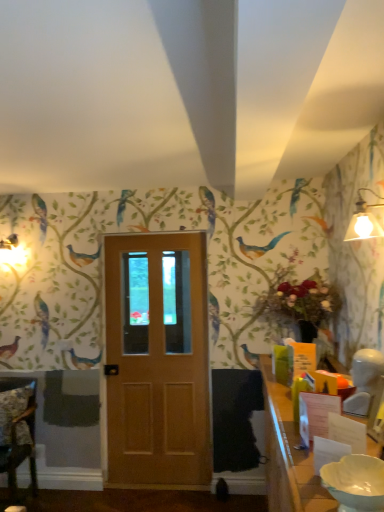
Describe the element at coordinates (355, 483) in the screenshot. The height and width of the screenshot is (512, 384). I see `white glossy bowl at lower right` at that location.

The image size is (384, 512). What do you see at coordinates (16, 437) in the screenshot?
I see `wooden chair at lower left` at bounding box center [16, 437].

Find the location of a particular element. matte wood door at center is located at coordinates (157, 360).

Looking at this image, could you tell me if wooden chair at lower left is turned towards matte white lampshade at upper right?

No, wooden chair at lower left does not turn towards matte white lampshade at upper right.

What's the angular difference between wooden chair at lower left and matte white lampshade at upper right's facing directions?

There is a 89.4-degree angle between the facing directions of wooden chair at lower left and matte white lampshade at upper right.

Is wooden chair at lower left far from matte white lampshade at upper right?

wooden chair at lower left is positioned a significant distance from matte white lampshade at upper right.

Is white glossy bowl at lower right inside or outside of matte white lampshade at upper right?

white glossy bowl at lower right exists outside the volume of matte white lampshade at upper right.

Is white glossy bowl at lower right facing towards matte white lampshade at upper right?

No, white glossy bowl at lower right is not aimed at matte white lampshade at upper right.

Is white glossy bowl at lower right behind matte white lampshade at upper right?

No, it is not.

Is white glossy bowl at lower right wider or thinner than matte white lampshade at upper right?

white glossy bowl at lower right is wider than matte white lampshade at upper right.

Is wooden chair at lower left positioned far away from white glossy bowl at lower right?

wooden chair at lower left is far away from white glossy bowl at lower right.

Considering the points (29, 381) and (349, 476), which point is in front, point (29, 381) or point (349, 476)?

Point (349, 476)

Image resolution: width=384 pixels, height=512 pixels. I want to click on bowl lying in front of the wooden chair at lower left, so click(355, 483).

Considering the relative positions of wooden chair at lower left and white glossy bowl at lower right in the image provided, is wooden chair at lower left to the left of white glossy bowl at lower right from the viewer's perspective?

Yes, wooden chair at lower left is to the left of white glossy bowl at lower right.

Based on the photo, is matte white lampshade at upper right far from white glossy table at lower right?

Yes, matte white lampshade at upper right and white glossy table at lower right are located far from each other.

From a real-world perspective, is matte white lampshade at upper right positioned under white glossy table at lower right based on gravity?

No, from a real-world perspective, matte white lampshade at upper right is not below white glossy table at lower right.

Is matte white lampshade at upper right behind white glossy table at lower right?

Yes.

From the picture: Is white glossy table at lower right bigger or smaller than matte white lampshade at upper right?

white glossy table at lower right is bigger than matte white lampshade at upper right.

Between white glossy table at lower right and matte white lampshade at upper right, which one has larger width?

Wider between the two is white glossy table at lower right.

Which is correct: white glossy table at lower right is inside matte white lampshade at upper right, or outside of it?

white glossy table at lower right is outside matte white lampshade at upper right.

Could you tell me if matte wood door at center is turned towards matte white lampshade at upper right?

No, matte wood door at center is not turned towards matte white lampshade at upper right.

Considering the positions of objects matte wood door at center and matte white lampshade at upper right in the image provided, who is more to the left, matte wood door at center or matte white lampshade at upper right?

matte wood door at center.

The image size is (384, 512). I want to click on light fixture on the right of matte wood door at center, so click(364, 220).

How far apart are matte white lampshade at upper right and wooden chair at lower left?

They are 8.81 feet apart.

In the scene shown: How many degrees apart are the facing directions of matte white lampshade at upper right and wooden chair at lower left?

89.4 degrees.

Is matte white lampshade at upper right oriented away from wooden chair at lower left?

No, matte white lampshade at upper right is not facing the opposite direction of wooden chair at lower left.

Is point (357, 234) behind point (2, 452)?

No, (357, 234) is closer to viewer.

Identify the location of chair on the left of matte white lampshade at upper right. [16, 437].

The image size is (384, 512). In order to click on light fixture that is above the white glossy bowl at lower right (from a real-world perspective) in this screenshot , I will do (x=364, y=220).

When comparing their distances from white glossy bowl at lower right, does matte white lampshade at upper right or white glossy table at lower right seem further?

The object further to white glossy bowl at lower right is matte white lampshade at upper right.

From the image, which object appears to be nearer to white glossy bowl at lower right, matte wood door at center or white glossy table at lower right?

The object closer to white glossy bowl at lower right is white glossy table at lower right.

Considering their positions, is wooden chair at lower left positioned closer to white glossy bowl at lower right than matte wood door at center?

matte wood door at center lies closer to white glossy bowl at lower right than the other object.

Looking at the image, which one is located further to white glossy table at lower right, matte wood door at center or white glossy bowl at lower right?

matte wood door at center is further to white glossy table at lower right.

Estimate the real-world distances between objects in this image. Which object is further from wooden chair at lower left, white glossy bowl at lower right or matte wood door at center?

Based on the image, white glossy bowl at lower right appears to be further to wooden chair at lower left.

From the image, which object appears to be farther from matte wood door at center, wooden chair at lower left or white glossy table at lower right?

white glossy table at lower right is positioned further to the anchor matte wood door at center.

Estimate the real-world distances between objects in this image. Which object is further from wooden chair at lower left, matte wood door at center or white glossy bowl at lower right?

white glossy bowl at lower right is positioned further to the anchor wooden chair at lower left.

From the image, which object appears to be nearer to white glossy bowl at lower right, white glossy table at lower right or matte white lampshade at upper right?

white glossy table at lower right lies closer to white glossy bowl at lower right than the other object.

You are a GUI agent. You are given a task and a screenshot of the screen. Output one action in this format:
    pyautogui.click(x=<x>, y=<y>)
    Task: Click on the bowl located between white glossy table at lower right and matte wood door at center in the depth direction
    
    Given the screenshot: What is the action you would take?
    pyautogui.click(x=355, y=483)

This screenshot has width=384, height=512. I want to click on bowl between wooden chair at lower left and matte white lampshade at upper right from left to right, so click(x=355, y=483).

You are a GUI agent. You are given a task and a screenshot of the screen. Output one action in this format:
    pyautogui.click(x=<x>, y=<y>)
    Task: Click on the bowl situated between wooden chair at lower left and white glossy table at lower right from left to right
    
    Given the screenshot: What is the action you would take?
    pyautogui.click(x=355, y=483)

The image size is (384, 512). What are the coordinates of `chair located between white glossy table at lower right and matte wood door at center in the depth direction` in the screenshot? It's located at (16, 437).